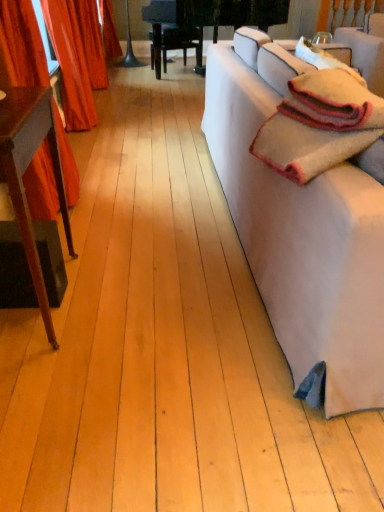
Question: Is white fabric couch at right a part of velvet red curtain at left, the second curtain when ordered from back to front?

Choices:
 (A) yes
 (B) no

Answer: (B)

Question: Can you confirm if velvet red curtain at left, marked as the 1th curtain in a front-to-back arrangement, is bigger than white fabric couch at right?

Choices:
 (A) yes
 (B) no

Answer: (B)

Question: Considering the relative sizes of velvet red curtain at left, marked as the 1th curtain in a front-to-back arrangement, and white fabric couch at right in the image provided, is velvet red curtain at left, marked as the 1th curtain in a front-to-back arrangement, smaller than white fabric couch at right?

Choices:
 (A) no
 (B) yes

Answer: (B)

Question: From the image's perspective, is velvet red curtain at left, marked as the 1th curtain in a front-to-back arrangement, below white fabric couch at right?

Choices:
 (A) no
 (B) yes

Answer: (A)

Question: Is velvet red curtain at left, the second curtain when ordered from back to front, placed right next to white fabric couch at right?

Choices:
 (A) yes
 (B) no

Answer: (B)

Question: From the image's perspective, is soft woolen blanket at right positioned above or below velvet red curtain at left, the second curtain when ordered from back to front?

Choices:
 (A) below
 (B) above

Answer: (A)

Question: Based on their sizes in the image, would you say soft woolen blanket at right is bigger or smaller than velvet red curtain at left, marked as the 1th curtain in a front-to-back arrangement?

Choices:
 (A) big
 (B) small

Answer: (B)

Question: Is soft woolen blanket at right taller or shorter than velvet red curtain at left, marked as the 1th curtain in a front-to-back arrangement?

Choices:
 (A) short
 (B) tall

Answer: (A)

Question: Looking at their shapes, would you say soft woolen blanket at right is wider or thinner than velvet red curtain at left, the second curtain when ordered from back to front?

Choices:
 (A) thin
 (B) wide

Answer: (B)

Question: Considering the relative positions of velvet red curtain at left, marked as the 1th curtain in a front-to-back arrangement, and velvet red curtain at left, marked as the 2th curtain in a front-to-back arrangement, in the image provided, is velvet red curtain at left, marked as the 1th curtain in a front-to-back arrangement, to the left or to the right of velvet red curtain at left, marked as the 2th curtain in a front-to-back arrangement,?

Choices:
 (A) left
 (B) right

Answer: (B)

Question: Is velvet red curtain at left, marked as the 1th curtain in a front-to-back arrangement, inside or outside of velvet red curtain at left, marked as the 2th curtain in a front-to-back arrangement?

Choices:
 (A) outside
 (B) inside

Answer: (A)

Question: From the image's perspective, relative to velvet red curtain at left, marked as the 2th curtain in a front-to-back arrangement, is velvet red curtain at left, marked as the 1th curtain in a front-to-back arrangement, above or below?

Choices:
 (A) above
 (B) below

Answer: (B)

Question: From their relative heights in the image, would you say velvet red curtain at left, the second curtain when ordered from back to front, is taller or shorter than velvet red curtain at left, the first curtain when ordered from back to front?

Choices:
 (A) short
 (B) tall

Answer: (B)

Question: Looking at the image, does mahogany wood table at left seem bigger or smaller compared to soft woolen blanket at right?

Choices:
 (A) small
 (B) big

Answer: (B)

Question: Considering their positions, is mahogany wood table at left located in front of or behind soft woolen blanket at right?

Choices:
 (A) front
 (B) behind

Answer: (B)